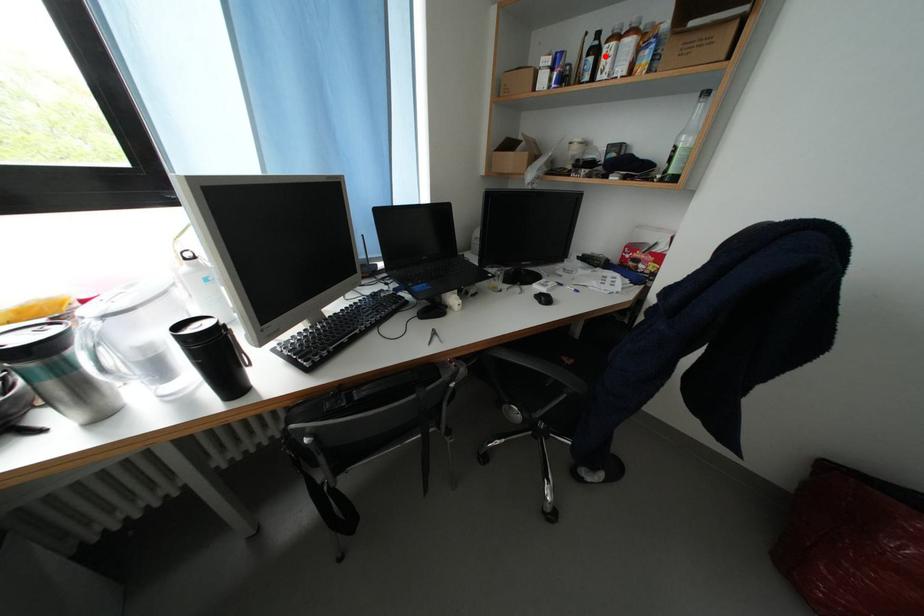
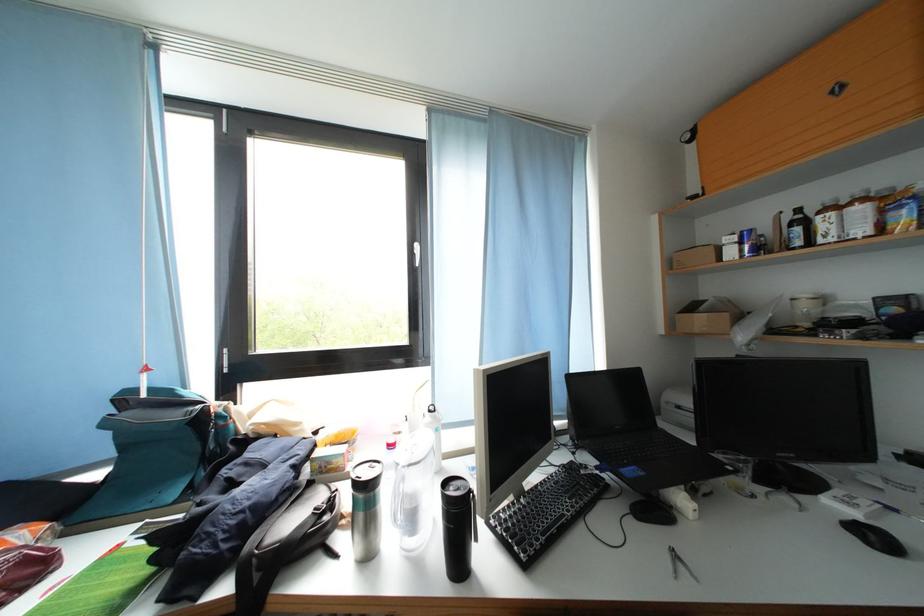
Question: I am providing you with two images of the same scene from different viewpoints. A red point is marked on the first image. At the location where the point appears in image 1, is it still visible in image 2?

Choices:
 (A) Yes
 (B) No

Answer: (A)